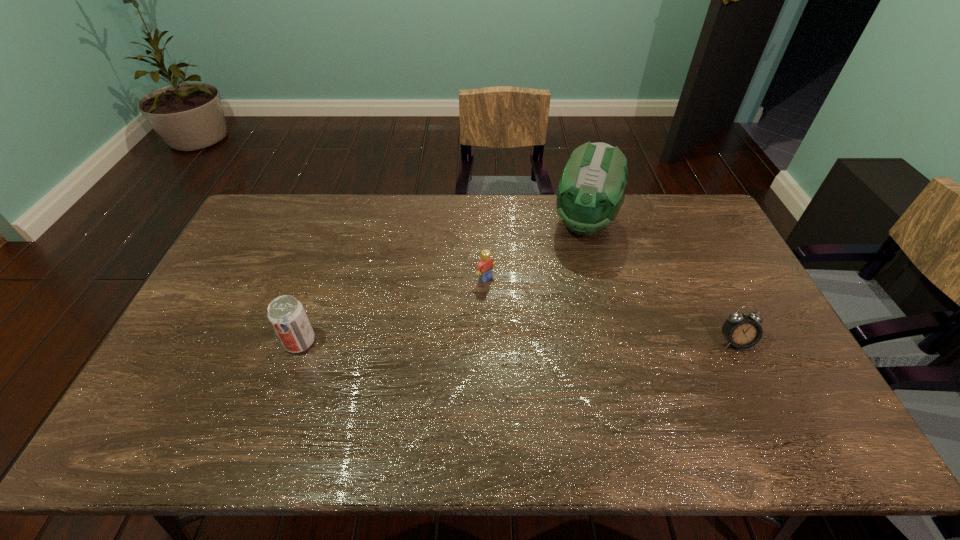
You are a GUI agent. You are given a task and a screenshot of the screen. Output one action in this format:
    pyautogui.click(x=<x>, y=<y>)
    Task: Click on the vacant area that lies between the tallest object and the second tallest object
    This screenshot has width=960, height=540.
    Given the screenshot: What is the action you would take?
    pyautogui.click(x=442, y=282)

Locate an element on the screen. free space between the soda can and the third object from right to left is located at coordinates (393, 310).

Image resolution: width=960 pixels, height=540 pixels. Find the location of `vacant area that lies between the second farthest object and the alarm clock`. vacant area that lies between the second farthest object and the alarm clock is located at coordinates (611, 310).

Locate an element on the screen. This screenshot has height=540, width=960. object that is the second closest to the football helmet is located at coordinates (741, 330).

Find the location of `object that stands as the third closest to the tallest object`. object that stands as the third closest to the tallest object is located at coordinates (286, 314).

Locate an element on the screen. The image size is (960, 540). free spot that satisfies the following two spatial constraints: 1. on the back side of the farthest object; 2. on the left side of the third nearest object is located at coordinates (485, 222).